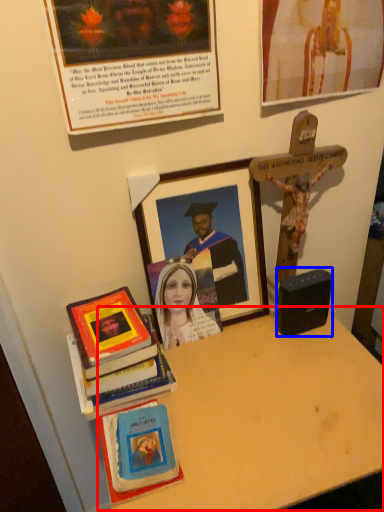
Question: Among these objects, which one is nearest to the camera, table (highlighted by a red box) or speaker (highlighted by a blue box)?

Choices:
 (A) table
 (B) speaker

Answer: (A)